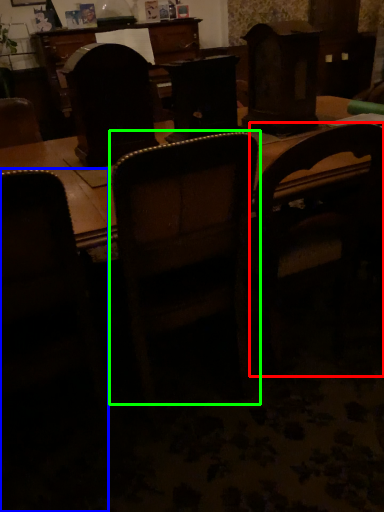
Question: Which is farther away from chair (highlighted by a red box)? chair (highlighted by a blue box) or chair (highlighted by a green box)?

Choices:
 (A) chair
 (B) chair

Answer: (A)